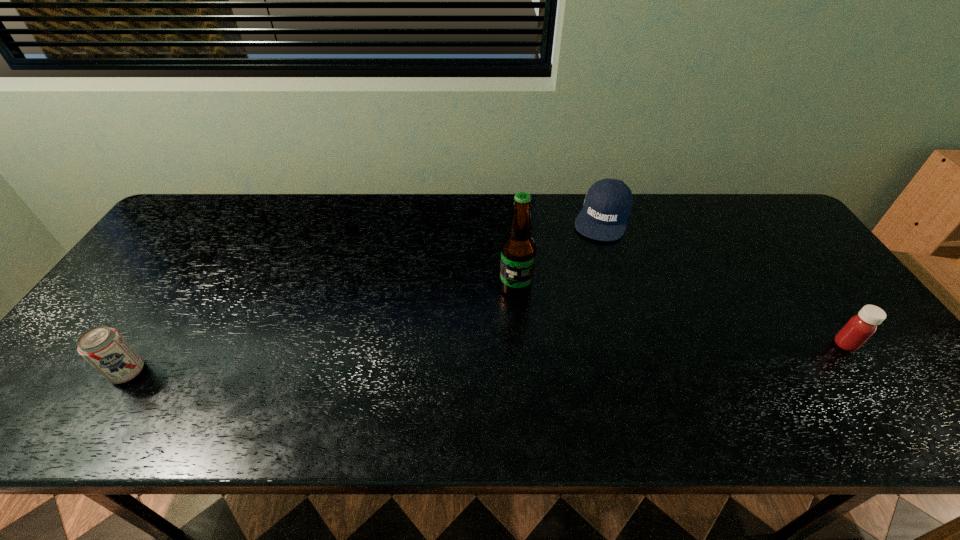
Locate an element on the screen. This screenshot has width=960, height=540. object present at the near left corner is located at coordinates (105, 349).

Image resolution: width=960 pixels, height=540 pixels. In the image, there is a desktop. Find the location of `vacant region at the far edge`. vacant region at the far edge is located at coordinates (554, 220).

In the image, there is a desktop. At what (x,y) coordinates should I click in order to perform the action: click on blank space at the near edge. Please return your answer as a coordinate pair (x, y). The height and width of the screenshot is (540, 960). Looking at the image, I should click on (245, 361).

At what (x,y) coordinates should I click in order to perform the action: click on vacant space at the left edge. Please return your answer as a coordinate pair (x, y). Image resolution: width=960 pixels, height=540 pixels. Looking at the image, I should click on (172, 271).

The image size is (960, 540). In order to click on free space at the right edge of the desktop in this screenshot , I will do pyautogui.click(x=817, y=284).

This screenshot has width=960, height=540. I want to click on vacant space at the far left corner of the desktop, so click(x=212, y=194).

In the image, there is a desktop. Identify the location of vacant area at the near left corner. (66, 380).

Find the location of a particular element. The height and width of the screenshot is (540, 960). free space between the shortest object and the second nearest object is located at coordinates (724, 281).

Where is `vacant area that lies between the medicine and the third nearest object`? This screenshot has height=540, width=960. vacant area that lies between the medicine and the third nearest object is located at coordinates (681, 316).

This screenshot has height=540, width=960. In order to click on vacant area that lies between the medicine and the shortest object in this screenshot , I will do `click(724, 281)`.